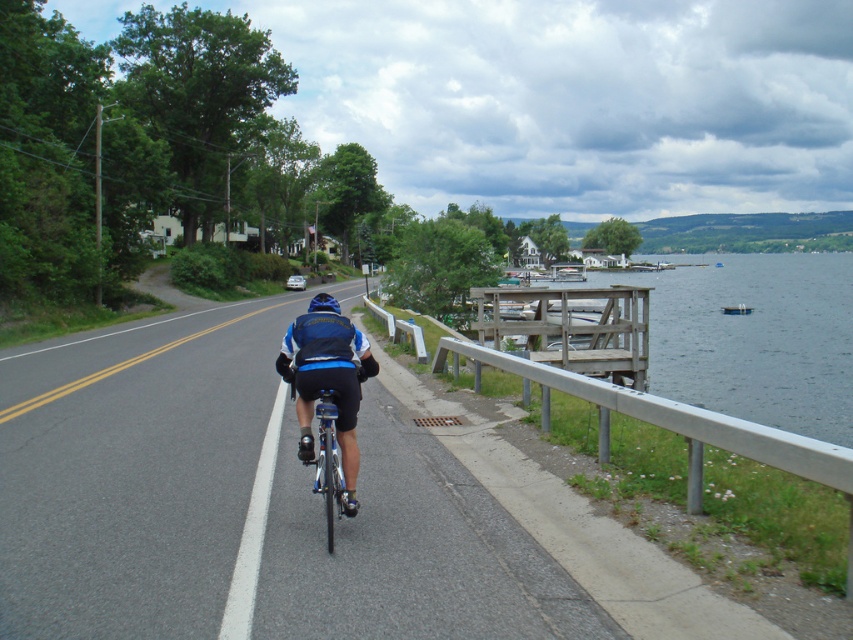
Question: Can you confirm if gray asphalt bike lane at center is positioned to the left of blue matte bicycle at center?

Choices:
 (A) yes
 (B) no

Answer: (A)

Question: Which of the following is the closest to the observer?

Choices:
 (A) (238, 342)
 (B) (329, 296)
 (C) (347, 394)
 (D) (670, 404)

Answer: (C)

Question: Is blue matte bicycle at center to the left of blue matte helmet at center from the viewer's perspective?

Choices:
 (A) yes
 (B) no

Answer: (B)

Question: Estimate the real-world distances between objects in this image. Which object is closer to the blue matte helmet at center?

Choices:
 (A) gray metallic rail at lower right
 (B) blue matte bicycle at center

Answer: (B)

Question: Observing the image, what is the correct spatial positioning of gray asphalt bike lane at center in reference to blue matte helmet at center?

Choices:
 (A) below
 (B) above

Answer: (A)

Question: Which of the following is the farthest from the observer?

Choices:
 (A) blue matte bicycle at center
 (B) gray asphalt bike lane at center
 (C) gray metallic rail at lower right
 (D) blue matte helmet at center

Answer: (D)